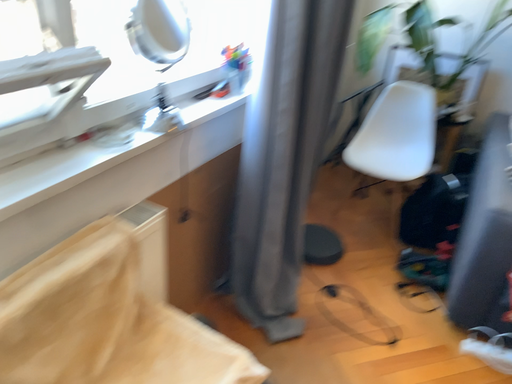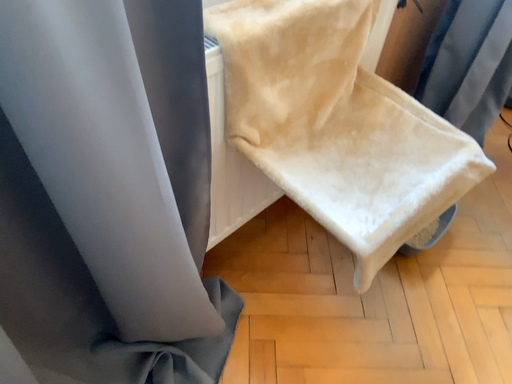
Question: Which way did the camera rotate in the video?

Choices:
 (A) rotated upward
 (B) rotated downward

Answer: (B)